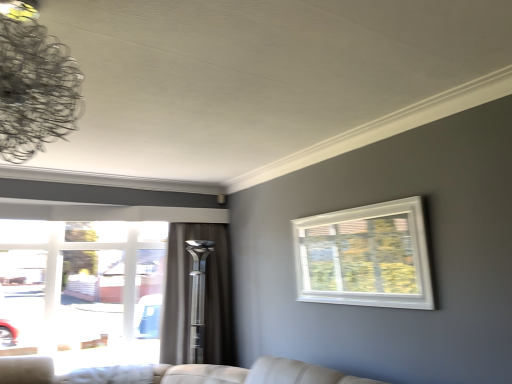
I want to click on clear glass window at left, arranged as the 2th window when viewed from the right, so click(x=86, y=278).

Locate an element on the screen. This screenshot has width=512, height=384. silky gray curtain at center is located at coordinates (205, 296).

How much space does white plastic window at upper right, which is counted as the first window, starting from the front, occupy vertically?

white plastic window at upper right, which is counted as the first window, starting from the front, is 24.47 inches in height.

In order to face metallic wire chandelier at upper left, should I rotate leftwards or rightwards?

Rotate left and turn 26.789 degrees.

What do you see at coordinates (34, 84) in the screenshot? I see `metallic wire chandelier at upper left` at bounding box center [34, 84].

What are the coordinates of `clear glass window at left, the first window when ordered from left to right` in the screenshot? It's located at (86, 278).

How different are the orientations of white plastic window at upper right, the 1th window viewed from the right, and clear glass window at left, arranged as the 2th window when viewed from the right, in degrees?

They differ by 90 degrees in their facing directions.

Is white plastic window at upper right, positioned as the second window in left-to-right order, beside clear glass window at left, arranged as the 2th window when viewed from the right?

No, white plastic window at upper right, positioned as the second window in left-to-right order, is not in contact with clear glass window at left, arranged as the 2th window when viewed from the right.

Measure the distance from white plastic window at upper right, positioned as the second window in left-to-right order, to clear glass window at left, the first window when ordered from left to right.

white plastic window at upper right, positioned as the second window in left-to-right order, and clear glass window at left, the first window when ordered from left to right, are 1.95 meters apart from each other.

Based on the photo, from the image's perspective, would you say white plastic window at upper right, the 1th window viewed from the right, is shown under clear glass window at left, the first window when ordered from left to right?

No, from the image's perspective, white plastic window at upper right, the 1th window viewed from the right, is not below clear glass window at left, the first window when ordered from left to right.

Is silky gray curtain at center directly adjacent to white plastic window at upper right, the 1th window viewed from the right?

silky gray curtain at center is not next to white plastic window at upper right, the 1th window viewed from the right, and they're not touching.

I want to click on the 2nd window directly above the silky gray curtain at center (from a real-world perspective), so click(365, 256).

From the image's perspective, is silky gray curtain at center located above white plastic window at upper right, the 1th window viewed from the right?

Incorrect, from the image's perspective, silky gray curtain at center is lower than white plastic window at upper right, the 1th window viewed from the right.

Is white plastic window at upper right, which is counted as the first window, starting from the front, at the left side of metallic wire chandelier at upper left?

No, white plastic window at upper right, which is counted as the first window, starting from the front, is not to the left of metallic wire chandelier at upper left.

Are white plastic window at upper right, the 1th window viewed from the right, and metallic wire chandelier at upper left beside each other?

white plastic window at upper right, the 1th window viewed from the right, and metallic wire chandelier at upper left are not in contact.

Looking at this image, would you say white plastic window at upper right, which is the second window in back-to-front order, is inside or outside metallic wire chandelier at upper left?

white plastic window at upper right, which is the second window in back-to-front order, is not inside metallic wire chandelier at upper left, it's outside.

From a real-world perspective, is white plastic window at upper right, the 1th window viewed from the right, located higher than metallic wire chandelier at upper left?

Actually, white plastic window at upper right, the 1th window viewed from the right, is physically below metallic wire chandelier at upper left in the real world.

From a real-world perspective, who is located higher, silky gray curtain at center or clear glass window at left, arranged as the 2th window when viewed from the right?

clear glass window at left, arranged as the 2th window when viewed from the right.

From the picture: Is silky gray curtain at center oriented towards clear glass window at left, arranged as the 2th window when viewed from the right?

No, silky gray curtain at center is not facing towards clear glass window at left, arranged as the 2th window when viewed from the right.

Find the location of a particular element. The width and height of the screenshot is (512, 384). window that is on the left side of silky gray curtain at center is located at coordinates (86, 278).

Can clear glass window at left, the first window when ordered from left to right, be found inside silky gray curtain at center?

No.

Is metallic wire chandelier at upper left not close to clear glass window at left, which appears as the 1th window when viewed from the back?

Yes, metallic wire chandelier at upper left is far from clear glass window at left, which appears as the 1th window when viewed from the back.

Is metallic wire chandelier at upper left in front of or behind clear glass window at left, the first window when ordered from left to right, in the image?

Visually, metallic wire chandelier at upper left is located in front of clear glass window at left, the first window when ordered from left to right.

From the image's perspective, which one is positioned lower, metallic wire chandelier at upper left or clear glass window at left, which appears as the 1th window when viewed from the back?

clear glass window at left, which appears as the 1th window when viewed from the back, from the image's perspective.

From a real-world perspective, is metallic wire chandelier at upper left physically located above or below clear glass window at left, the first window when ordered from left to right?

From a real-world perspective, metallic wire chandelier at upper left is physically above clear glass window at left, the first window when ordered from left to right.

Identify the location of curtain that is on the right side of clear glass window at left, the first window when ordered from left to right. (205, 296).

Between clear glass window at left, which appears as the 1th window when viewed from the back, and silky gray curtain at center, which one is positioned behind?

silky gray curtain at center is further from the camera.

From a real-world perspective, between clear glass window at left, which appears as the 1th window when viewed from the back, and silky gray curtain at center, who is vertically lower?

silky gray curtain at center.

From a real-world perspective, which object rests below the other?

From a 3D spatial view, silky gray curtain at center is below.

Which is behind, point (371, 300) or point (234, 349)?

The point (234, 349) is farther from the camera.

Which of these two, white plastic window at upper right, the 1th window viewed from the right, or silky gray curtain at center, is wider?

With larger width is silky gray curtain at center.

Identify the location of window positioned vertically above the clear glass window at left, arranged as the 2th window when viewed from the front (from a real-world perspective). (365, 256).

Which window is the 2nd one when counting from the front of the silky gray curtain at center? Please provide its 2D coordinates.

[(365, 256)]

Based on their spatial positions, is clear glass window at left, arranged as the 2th window when viewed from the front, or metallic wire chandelier at upper left further from white plastic window at upper right, positioned as the second window in left-to-right order?

Answer: Among the two, clear glass window at left, arranged as the 2th window when viewed from the front, is located further to white plastic window at upper right, positioned as the second window in left-to-right order.

Based on their spatial positions, is clear glass window at left, the first window when ordered from left to right, or silky gray curtain at center closer to metallic wire chandelier at upper left?

clear glass window at left, the first window when ordered from left to right.

Looking at the image, which one is located closer to silky gray curtain at center, white plastic window at upper right, the 1th window viewed from the right, or metallic wire chandelier at upper left?

Based on the image, white plastic window at upper right, the 1th window viewed from the right, appears to be nearer to silky gray curtain at center.

Looking at the image, which one is located closer to metallic wire chandelier at upper left, silky gray curtain at center or clear glass window at left, arranged as the 2th window when viewed from the right?

The object closer to metallic wire chandelier at upper left is clear glass window at left, arranged as the 2th window when viewed from the right.

When comparing their distances from silky gray curtain at center, does metallic wire chandelier at upper left or white plastic window at upper right, which is the second window in back-to-front order, seem closer?

white plastic window at upper right, which is the second window in back-to-front order, is closer to silky gray curtain at center.

When comparing their distances from silky gray curtain at center, does white plastic window at upper right, positioned as the second window in left-to-right order, or clear glass window at left, which appears as the 1th window when viewed from the back, seem closer?

The object closer to silky gray curtain at center is clear glass window at left, which appears as the 1th window when viewed from the back.

Which object lies further to the anchor point metallic wire chandelier at upper left, silky gray curtain at center or white plastic window at upper right, the 1th window viewed from the right?

Among the two, silky gray curtain at center is located further to metallic wire chandelier at upper left.

From the image, which object appears to be farther from clear glass window at left, which appears as the 1th window when viewed from the back, metallic wire chandelier at upper left or silky gray curtain at center?

Based on the image, metallic wire chandelier at upper left appears to be further to clear glass window at left, which appears as the 1th window when viewed from the back.

You are a GUI agent. You are given a task and a screenshot of the screen. Output one action in this format:
    pyautogui.click(x=<x>, y=<y>)
    Task: Click on the curtain situated between clear glass window at left, the first window when ordered from left to right, and white plastic window at upper right, which is the second window in back-to-front order, from left to right
    
    Given the screenshot: What is the action you would take?
    pyautogui.click(x=205, y=296)

At what (x,y) coordinates should I click in order to perform the action: click on lamp located between clear glass window at left, the first window when ordered from left to right, and white plastic window at upper right, which is the second window in back-to-front order, in the left-right direction. Please return your answer as a coordinate pair (x, y). Looking at the image, I should click on (34, 84).